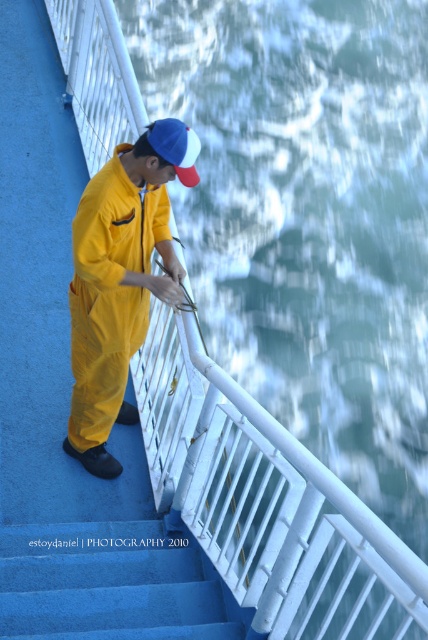
Between blue carpeted stairs at lower left and blue fabric cap at upper center, which one is positioned lower?

blue carpeted stairs at lower left is below.

Describe the element at coordinates (110, 584) in the screenshot. Image resolution: width=428 pixels, height=640 pixels. I see `blue carpeted stairs at lower left` at that location.

Between point (118, 611) and point (177, 140), which one is positioned in front?

Point (177, 140) is in front.

Find the location of a particular element. blue carpeted stairs at lower left is located at coordinates (110, 584).

Is yellow matte jumpsuit at center taller than blue fabric cap at upper center?

Indeed, yellow matte jumpsuit at center has a greater height compared to blue fabric cap at upper center.

Does point (122, 406) lie behind point (171, 125)?

Yes, it is behind point (171, 125).

Where is `yellow matte jumpsuit at center`? yellow matte jumpsuit at center is located at coordinates (121, 280).

Does yellow matte jumpsuit at center lie behind blue carpeted stairs at lower left?

Yes, yellow matte jumpsuit at center is further from the viewer.

Is point (85, 369) closer to camera compared to point (38, 573)?

No, it is not.

You are a GUI agent. You are given a task and a screenshot of the screen. Output one action in this format:
    pyautogui.click(x=<x>, y=<y>)
    Task: Click on the yellow matte jumpsuit at center
    The width and height of the screenshot is (428, 640).
    Given the screenshot: What is the action you would take?
    pyautogui.click(x=121, y=280)